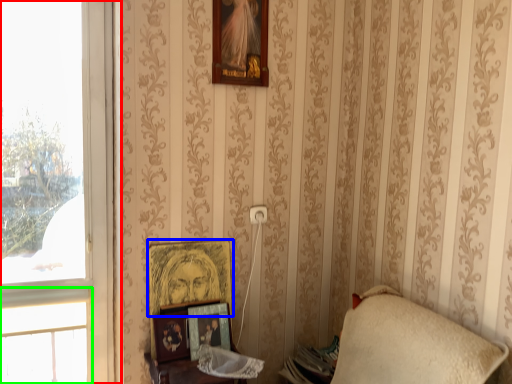
Question: Which is nearer to the window (highlighted by a red box)? picture frame (highlighted by a blue box) or window (highlighted by a green box).

Choices:
 (A) picture frame
 (B) window

Answer: (B)